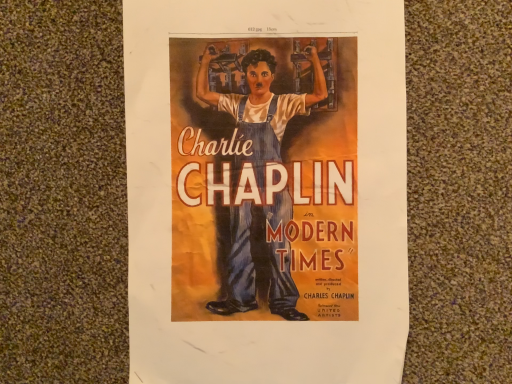
Where is `matte blue overalls at center`? This screenshot has height=384, width=512. matte blue overalls at center is located at coordinates (266, 191).

This screenshot has width=512, height=384. What do you see at coordinates (266, 191) in the screenshot?
I see `matte blue overalls at center` at bounding box center [266, 191].

Identify the location of matte blue overalls at center. This screenshot has height=384, width=512. (266, 191).